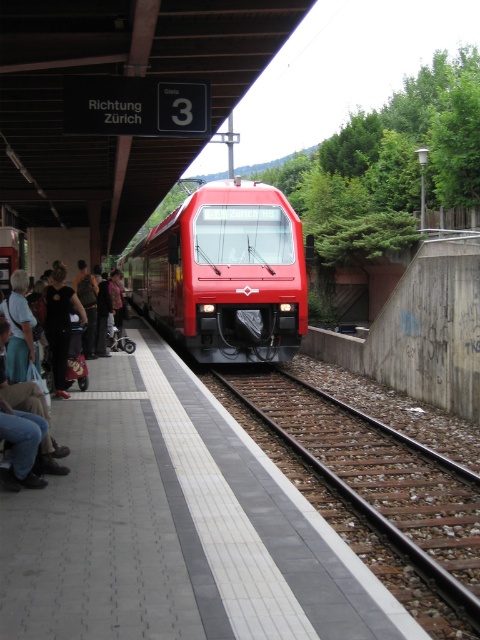
You are standing on the train station platform and want to board the shiny red train at center. There is a black fabric bag at left blocking your path. Can you step around it without moving the bag?

The shiny red train at center is further to the viewer than the black fabric bag at left, so the bag is closer to you. You can step around the bag to reach the train since it is in front of you.

In the scene shown: You are a traveler at the train station platform. You see a black fabric bag at left and a dark gray fabric jacket at left. Which item is taller?

The dark gray fabric jacket at left is taller than the black fabric bag at left.